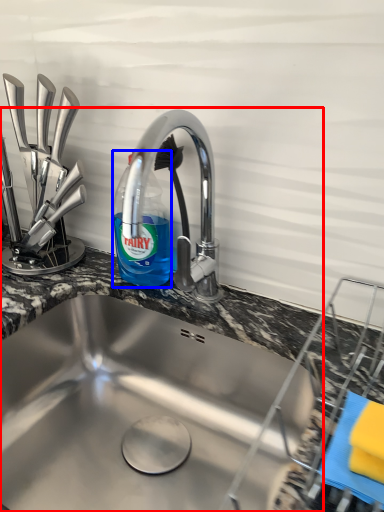
Question: Among these objects, which one is farthest to the camera, sink (highlighted by a red box) or bottle (highlighted by a blue box)?

Choices:
 (A) sink
 (B) bottle

Answer: (B)